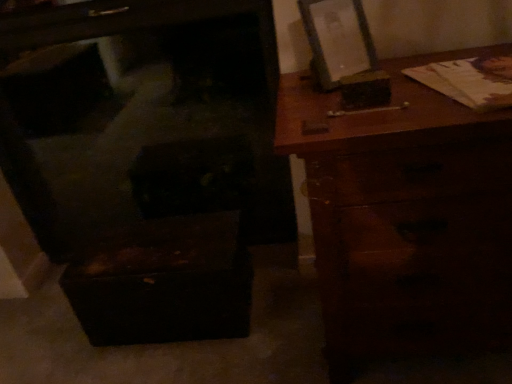
Question: Should I look upward or downward to see wooden chest at lower left?

Choices:
 (A) up
 (B) down

Answer: (A)

Question: Can you confirm if brown wooden chest of drawers at right is smaller than wooden picture frame at upper right?

Choices:
 (A) no
 (B) yes

Answer: (A)

Question: From a real-world perspective, is brown wooden chest of drawers at right physically below wooden picture frame at upper right?

Choices:
 (A) no
 (B) yes

Answer: (B)

Question: From the image's perspective, is brown wooden chest of drawers at right above wooden picture frame at upper right?

Choices:
 (A) yes
 (B) no

Answer: (B)

Question: Is wooden picture frame at upper right located within brown wooden chest of drawers at right?

Choices:
 (A) yes
 (B) no

Answer: (B)

Question: Does brown wooden chest of drawers at right appear on the right side of wooden picture frame at upper right?

Choices:
 (A) no
 (B) yes

Answer: (B)

Question: Is brown wooden chest of drawers at right positioned in front of wooden picture frame at upper right?

Choices:
 (A) no
 (B) yes

Answer: (B)

Question: From a real-world perspective, is wooden picture frame at upper right located higher than wooden chest at lower left?

Choices:
 (A) yes
 (B) no

Answer: (A)

Question: Are wooden picture frame at upper right and wooden chest at lower left far apart?

Choices:
 (A) no
 (B) yes

Answer: (B)

Question: Is wooden picture frame at upper right shorter than wooden chest at lower left?

Choices:
 (A) yes
 (B) no

Answer: (A)

Question: Can you confirm if wooden picture frame at upper right is thinner than wooden chest at lower left?

Choices:
 (A) no
 (B) yes

Answer: (B)

Question: Can you confirm if wooden picture frame at upper right is bigger than wooden chest at lower left?

Choices:
 (A) yes
 (B) no

Answer: (B)

Question: Is wooden picture frame at upper right located outside wooden chest at lower left?

Choices:
 (A) yes
 (B) no

Answer: (A)

Question: Considering the relative sizes of wooden chest at lower left and wooden picture frame at upper right in the image provided, is wooden chest at lower left wider than wooden picture frame at upper right?

Choices:
 (A) yes
 (B) no

Answer: (A)